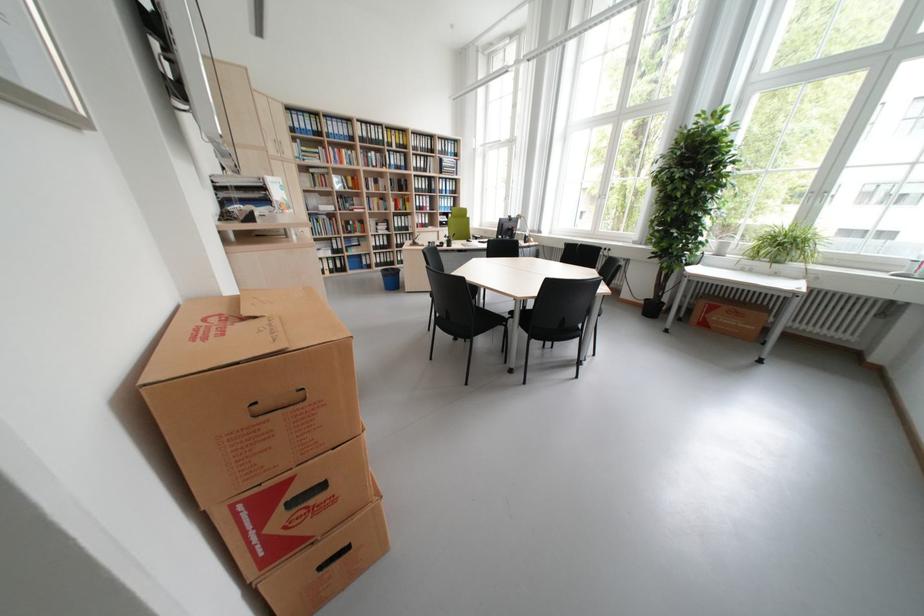
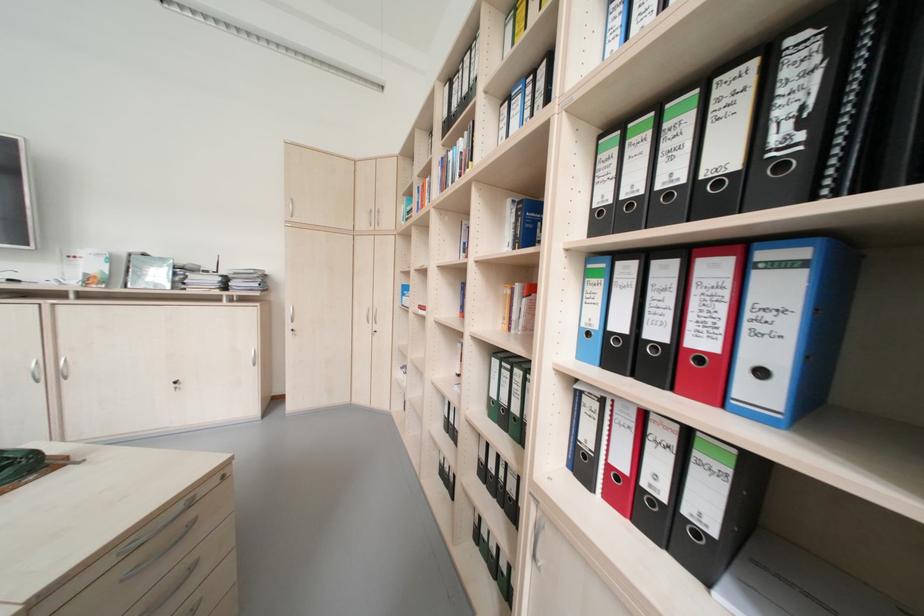
The point at (x=438, y=201) is marked in the first image. Where is the corresponding point in the second image?

(793, 290)